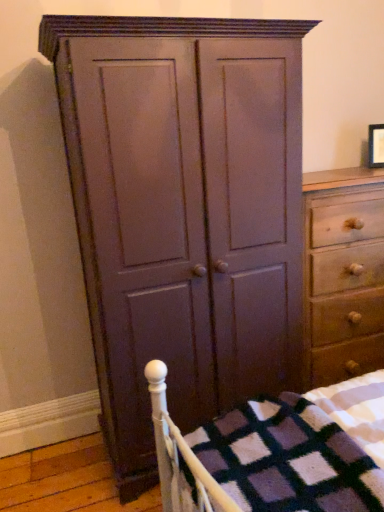
Question: Can we say matte black picture frame at upper right lies outside matte wood cupboard at center?

Choices:
 (A) no
 (B) yes

Answer: (B)

Question: Considering the relative sizes of matte black picture frame at upper right and matte wood cupboard at center in the image provided, is matte black picture frame at upper right bigger than matte wood cupboard at center?

Choices:
 (A) no
 (B) yes

Answer: (A)

Question: Considering the relative positions of matte black picture frame at upper right and matte wood cupboard at center in the image provided, is matte black picture frame at upper right in front of matte wood cupboard at center?

Choices:
 (A) no
 (B) yes

Answer: (A)

Question: From a real-world perspective, is matte black picture frame at upper right positioned under matte wood cupboard at center based on gravity?

Choices:
 (A) no
 (B) yes

Answer: (A)

Question: Is matte black picture frame at upper right directly adjacent to matte wood cupboard at center?

Choices:
 (A) yes
 (B) no

Answer: (B)

Question: Does matte black picture frame at upper right turn towards matte wood cupboard at center?

Choices:
 (A) yes
 (B) no

Answer: (B)

Question: From a real-world perspective, is matte black picture frame at upper right positioned over light brown wood chest of drawers at right based on gravity?

Choices:
 (A) no
 (B) yes

Answer: (B)

Question: Considering the relative sizes of matte black picture frame at upper right and light brown wood chest of drawers at right in the image provided, is matte black picture frame at upper right smaller than light brown wood chest of drawers at right?

Choices:
 (A) yes
 (B) no

Answer: (A)

Question: From a real-world perspective, is matte black picture frame at upper right located beneath light brown wood chest of drawers at right?

Choices:
 (A) yes
 (B) no

Answer: (B)

Question: Considering the relative sizes of matte black picture frame at upper right and light brown wood chest of drawers at right in the image provided, is matte black picture frame at upper right shorter than light brown wood chest of drawers at right?

Choices:
 (A) yes
 (B) no

Answer: (A)

Question: Is light brown wood chest of drawers at right at the back of matte black picture frame at upper right?

Choices:
 (A) no
 (B) yes

Answer: (A)

Question: From the image's perspective, is matte black picture frame at upper right beneath light brown wood chest of drawers at right?

Choices:
 (A) yes
 (B) no

Answer: (B)

Question: Is light brown wood chest of drawers at right thinner than matte wood cupboard at center?

Choices:
 (A) yes
 (B) no

Answer: (A)